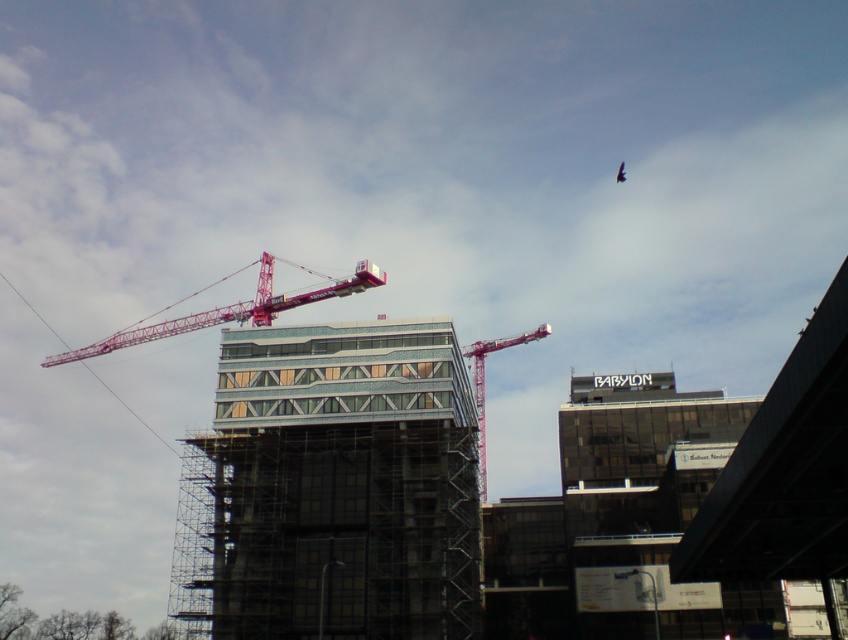
Between pink metallic crane at upper center and metallic pink crane at upper center, which one appears on the right side from the viewer's perspective?

Positioned to the right is metallic pink crane at upper center.

In the scene shown: Does pink metallic crane at upper center have a lesser width compared to metallic pink crane at upper center?

In fact, pink metallic crane at upper center might be wider than metallic pink crane at upper center.

Is point (192, 321) more distant than point (530, 337)?

No, it is in front of (530, 337).

You are a GUI agent. You are given a task and a screenshot of the screen. Output one action in this format:
    pyautogui.click(x=<x>, y=<y>)
    Task: Click on the pink metallic crane at upper center
    The image size is (848, 640).
    Given the screenshot: What is the action you would take?
    pyautogui.click(x=230, y=310)

Who is lower down, glassy steel building at center or metallic pink crane at upper center?

glassy steel building at center

What do you see at coordinates (336, 486) in the screenshot?
I see `glassy steel building at center` at bounding box center [336, 486].

Which is behind, point (310, 534) or point (471, 352)?

Point (471, 352)

Identify the location of glassy steel building at center. The width and height of the screenshot is (848, 640). (336, 486).

Does point (300, 500) lie in front of point (282, 294)?

That is True.

Does glassy steel building at center have a smaller size compared to pink metallic crane at upper center?

Incorrect, glassy steel building at center is not smaller in size than pink metallic crane at upper center.

This screenshot has width=848, height=640. Describe the element at coordinates (336, 486) in the screenshot. I see `glassy steel building at center` at that location.

The image size is (848, 640). What are the coordinates of `glassy steel building at center` in the screenshot? It's located at (336, 486).